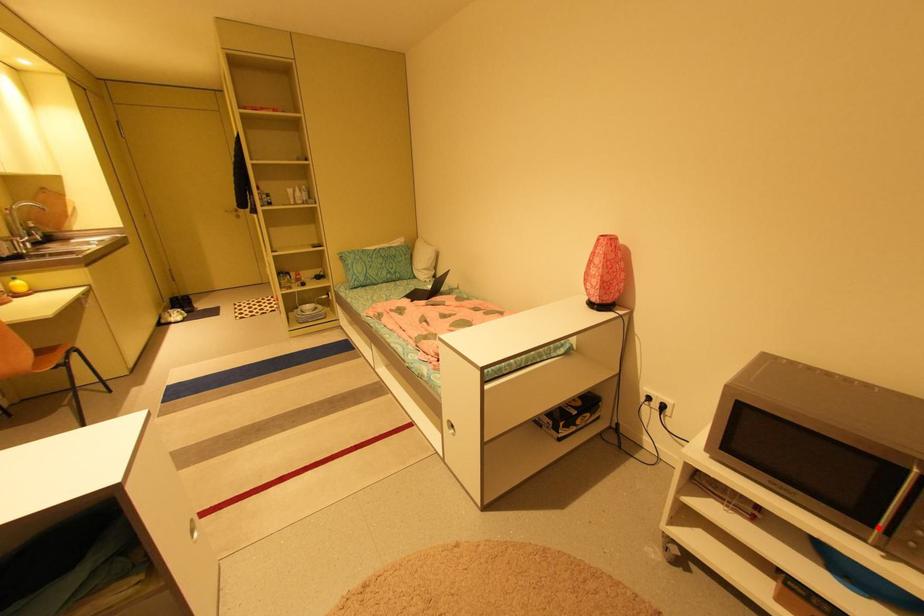
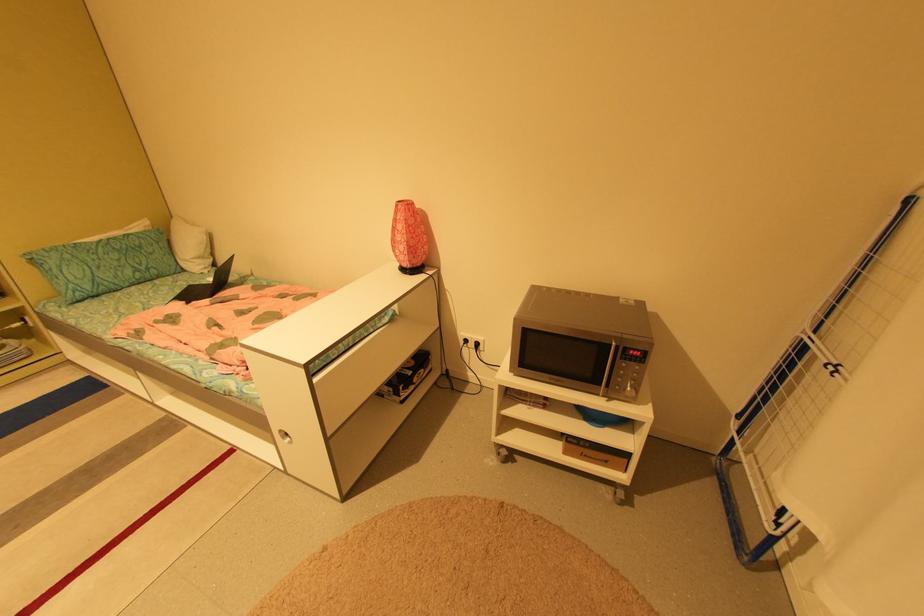
Where in the second image is the point corresponding to the highlighted location from the first image?

(606, 386)